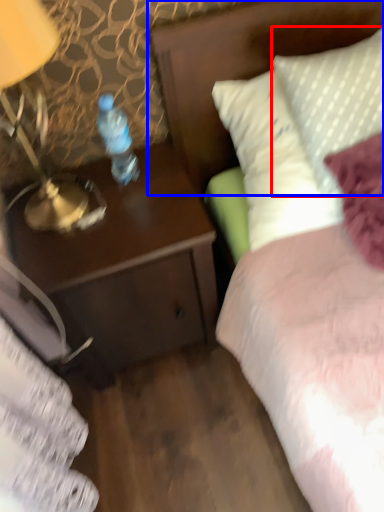
Question: Which object appears farthest to the camera in this image, pillow (highlighted by a red box) or headboard (highlighted by a blue box)?

Choices:
 (A) pillow
 (B) headboard

Answer: (B)